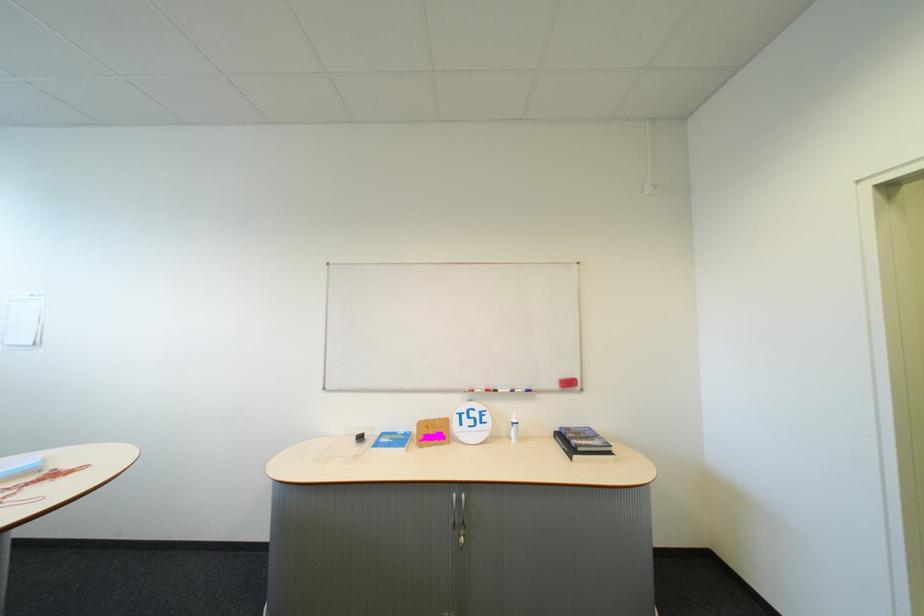
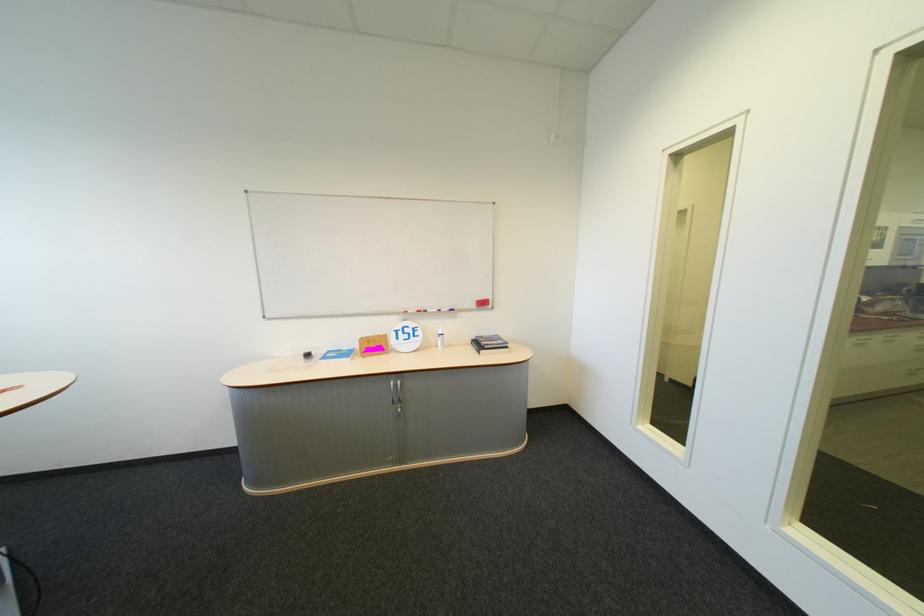
Question: In a continuous first-person perspective shot, in which direction is the camera moving?

Choices:
 (A) Left
 (B) Right
 (C) Forward
 (D) Backward

Answer: (D)